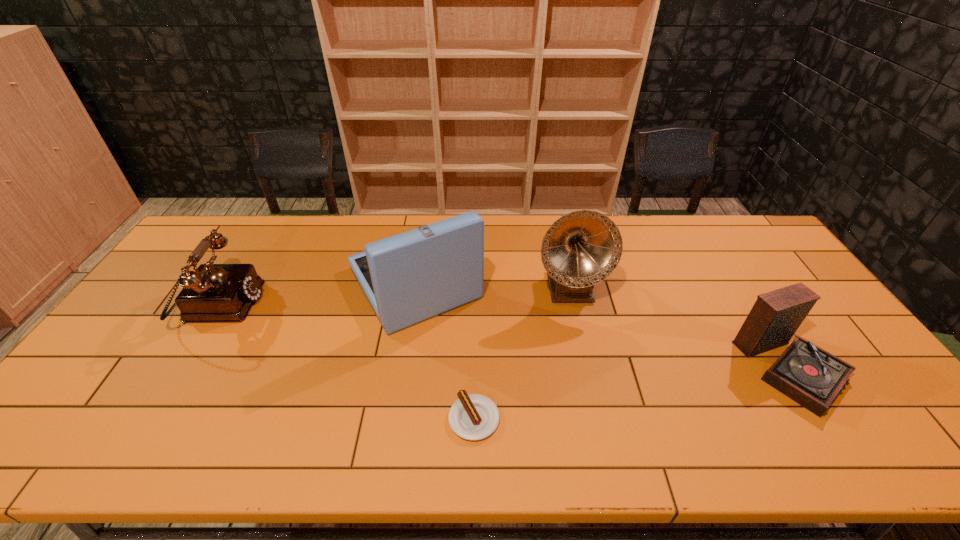
Locate an element on the screen. This screenshot has width=960, height=540. free point between the leftmost phonograph record and the second phonograph record from left to right is located at coordinates (492, 285).

At what (x,y) coordinates should I click in order to perform the action: click on unoccupied area between the shortest phonograph record and the second phonograph record from right to left. Please return your answer as a coordinate pair (x, y). Looking at the image, I should click on (681, 327).

You are a GUI agent. You are given a task and a screenshot of the screen. Output one action in this format:
    pyautogui.click(x=<x>, y=<y>)
    Task: Click on the empty location between the shortest object and the rightmost object
    Image resolution: width=960 pixels, height=540 pixels.
    Given the screenshot: What is the action you would take?
    pyautogui.click(x=634, y=392)

You are a GUI agent. You are given a task and a screenshot of the screen. Output one action in this format:
    pyautogui.click(x=<x>, y=<y>)
    Task: Click on the free space that is in between the shortest object and the rightmost phonograph record
    
    Given the screenshot: What is the action you would take?
    pyautogui.click(x=634, y=392)

The width and height of the screenshot is (960, 540). In order to click on unoccupied area between the second phonograph record from right to left and the rightmost object in this screenshot , I will do `click(681, 327)`.

The image size is (960, 540). I want to click on unoccupied area between the leftmost phonograph record and the fourth object from left to right, so click(492, 285).

I want to click on vacant space that's between the second phonograph record from left to right and the sausage, so (x=521, y=353).

This screenshot has height=540, width=960. In order to click on free spot between the sausage and the rightmost object in this screenshot , I will do `click(634, 392)`.

Identify the location of unoccupied area between the second phonograph record from left to right and the sausage. This screenshot has height=540, width=960. (521, 353).

Find the location of a particular element. The height and width of the screenshot is (540, 960). vacant space in between the telephone and the rightmost phonograph record is located at coordinates (506, 336).